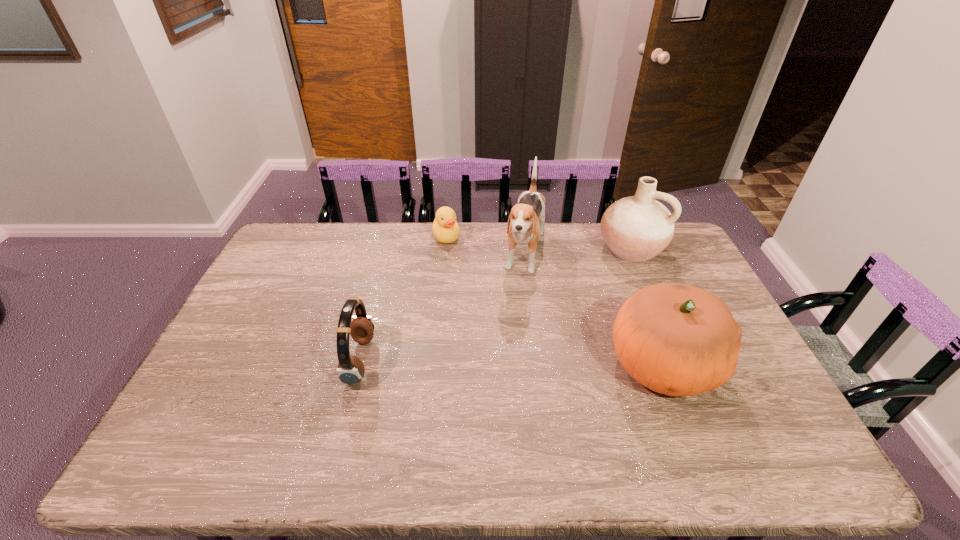
The image size is (960, 540). Identify the location of object that is the second closest to the duck. (350, 370).

Locate which object ranks in proximity to the shortest object. Please provide its 2D coordinates. Your answer should be formatted as a tuple, i.e. [(x, y)], where the tuple contains the x and y coordinates of a point satisfying the conditions above.

[(526, 221)]

Identify the location of vacant area that satisfies the following two spatial constraints: 1. on the front side of the fourth object from right to left; 2. on the left side of the pottery. (445, 248).

The width and height of the screenshot is (960, 540). What are the coordinates of `vacant region that satisfies the following two spatial constraints: 1. on the front side of the duck; 2. on the right side of the pottery` in the screenshot? It's located at (445, 248).